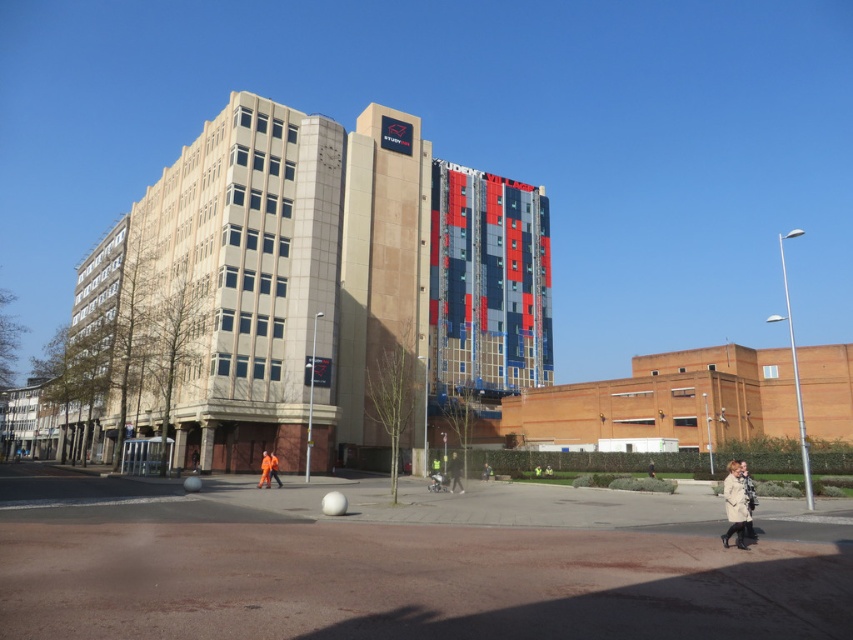
You are a delivery person who needs to hand a package to the recipient standing near the yellow reflective vest at center. You are currently standing next to the light brown leather coat at lower right. Can you directly hand the package to them without moving past the bollards?

The light brown leather coat at lower right is located above the yellow reflective vest at center, meaning the recipient is below you. Since you are on the same level, you can directly hand the package without needing to move past the bollards.